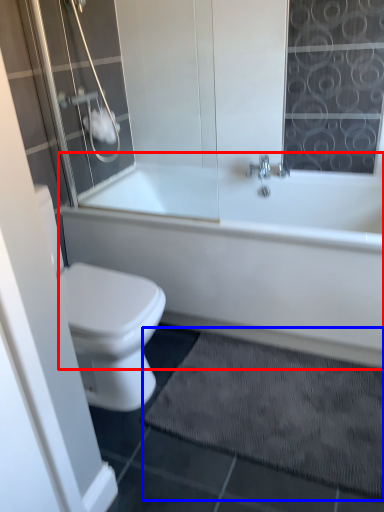
Question: Which object appears closest to the camera in this image, bathtub (highlighted by a red box) or bath mat (highlighted by a blue box)?

Choices:
 (A) bathtub
 (B) bath mat

Answer: (B)